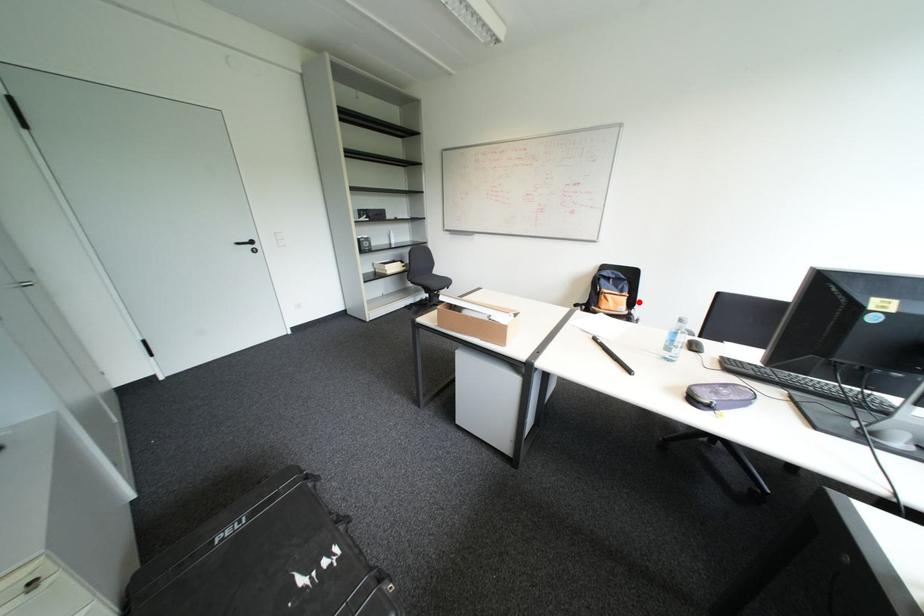
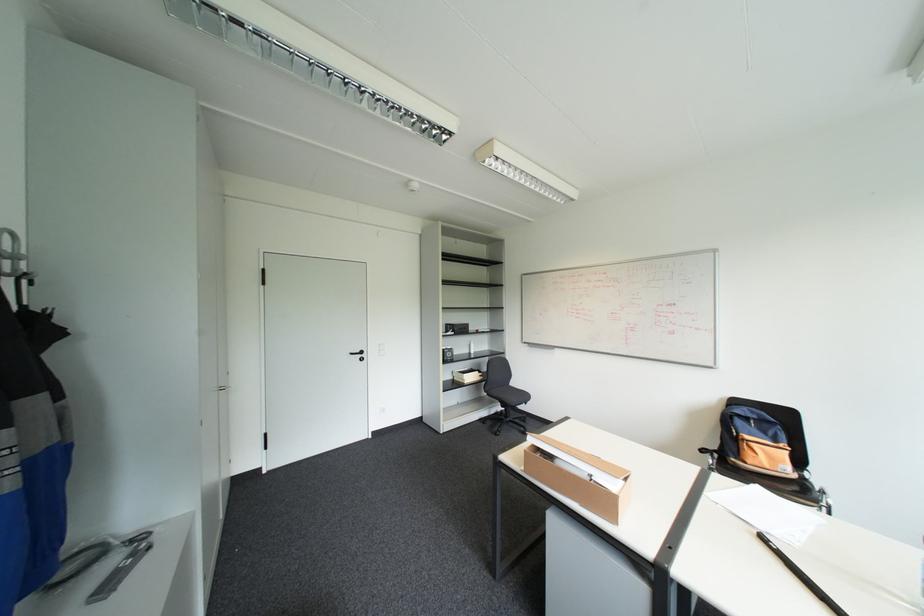
Where in the second image is the point corresponding to the highlighted location from the first image?

(808, 460)